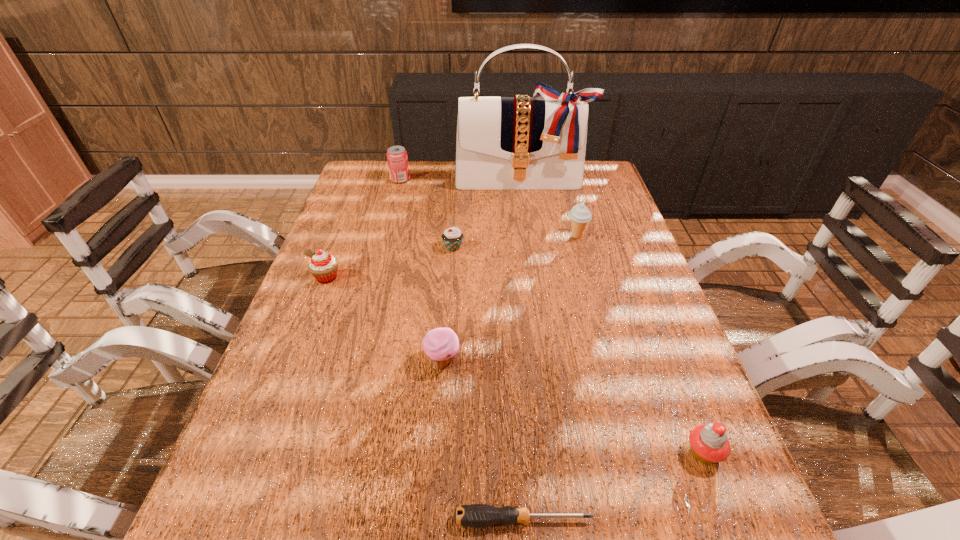
I want to click on the tallest object, so tap(502, 143).

Where is `the seventh object from right to left`? Image resolution: width=960 pixels, height=540 pixels. the seventh object from right to left is located at coordinates (397, 159).

Where is `icecream`? The height and width of the screenshot is (540, 960). icecream is located at coordinates (580, 215).

You are a GUI agent. You are given a task and a screenshot of the screen. Output one action in this format:
    pyautogui.click(x=<x>, y=<y>)
    Task: Click on the leftmost cupcake
    The width and height of the screenshot is (960, 540).
    Given the screenshot: What is the action you would take?
    pyautogui.click(x=323, y=266)

You are a GUI agent. You are given a task and a screenshot of the screen. Output one action in this format:
    pyautogui.click(x=<x>, y=<y>)
    Task: Click on the second farthest cupcake
    
    Given the screenshot: What is the action you would take?
    click(323, 266)

The width and height of the screenshot is (960, 540). I want to click on the farthest cupcake, so point(452,237).

Where is `the second nearest object`? The width and height of the screenshot is (960, 540). the second nearest object is located at coordinates (709, 443).

The width and height of the screenshot is (960, 540). What are the coordinates of `the rightmost cupcake` in the screenshot? It's located at (709, 443).

At what (x,y) coordinates should I click in order to perform the action: click on the third nearest object. Please return your answer as a coordinate pair (x, y). Looking at the image, I should click on (441, 345).

In order to click on screwdriver in this screenshot , I will do `click(475, 515)`.